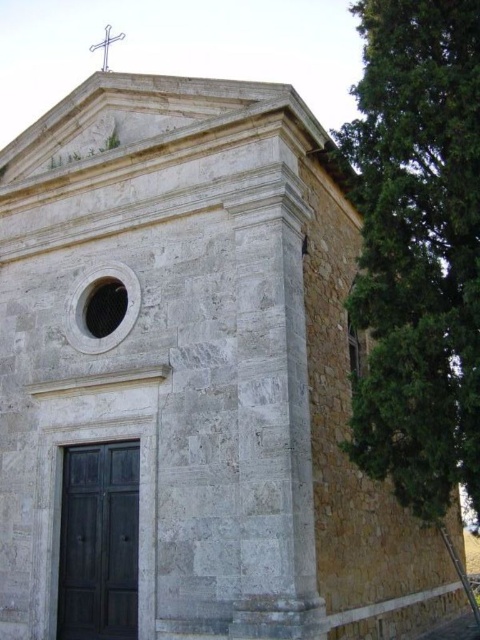
Question: Among these points, which one is nearest to the camera?

Choices:
 (A) (466, 444)
 (B) (108, 44)

Answer: (A)

Question: Which point is farther to the camera?

Choices:
 (A) green textured tree at right
 (B) white wooden cross at upper center

Answer: (B)

Question: Where is green textured tree at right located in relation to white wooden cross at upper center in the image?

Choices:
 (A) below
 (B) above

Answer: (A)

Question: Is green textured tree at right above white wooden cross at upper center?

Choices:
 (A) no
 (B) yes

Answer: (A)

Question: In this image, where is green textured tree at right located relative to white wooden cross at upper center?

Choices:
 (A) below
 (B) above

Answer: (A)

Question: Which object appears closest to the camera in this image?

Choices:
 (A) green textured tree at right
 (B) white wooden cross at upper center

Answer: (A)